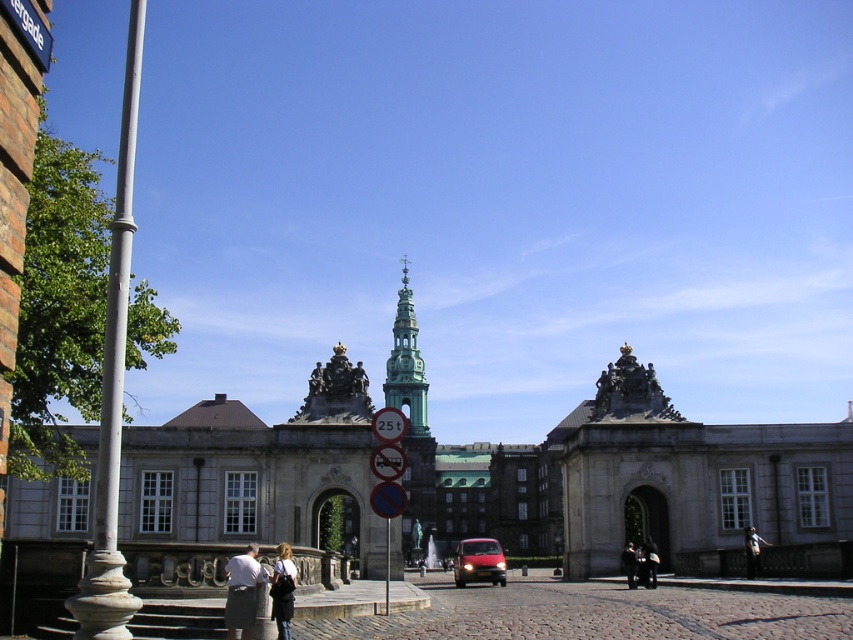
Question: Which of the following is the closest to the observer?

Choices:
 (A) white stone pole at left
 (B) red plastic speed limit sign at center

Answer: (A)

Question: Which point is farther to the camera?

Choices:
 (A) (767, 541)
 (B) (651, 557)

Answer: (A)

Question: Where is white stone pole at left located in relation to dark gray fabric couple at center in the image?

Choices:
 (A) below
 (B) above

Answer: (B)

Question: Which point is closer to the camera?

Choices:
 (A) metallic circular sign at center
 (B) green stone tower at center

Answer: (A)

Question: Does light brown leather jacket at lower right come behind dark brown leather jacket at lower right?

Choices:
 (A) no
 (B) yes

Answer: (A)

Question: Can you confirm if dark gray fabric couple at center is bigger than metallic circular sign at center?

Choices:
 (A) no
 (B) yes

Answer: (B)